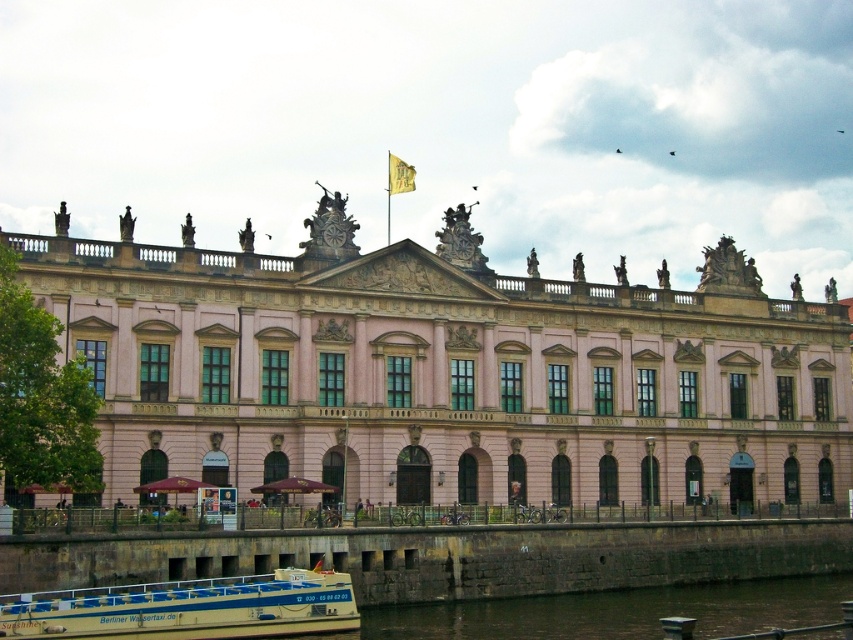
Question: Among these objects, which one is nearest to the camera?

Choices:
 (A) white plastic boat at lower left
 (B) pink stone building at center

Answer: (A)

Question: Which point is farther to the camera?

Choices:
 (A) (144, 624)
 (B) (405, 164)
 (C) (659, 634)
 (D) (775, 410)

Answer: (D)

Question: Which of these objects is positioned farthest from the dark stone wall at lower center?

Choices:
 (A) white plastic boat at lower left
 (B) yellow fabric flag at upper center

Answer: (B)

Question: Does pink stone building at center appear under yellow fabric flag at upper center?

Choices:
 (A) no
 (B) yes

Answer: (B)

Question: Observing the image, what is the correct spatial positioning of white plastic boat at lower left in reference to yellow fabric flag at upper center?

Choices:
 (A) above
 (B) below

Answer: (B)

Question: Is the position of dark stone wall at lower center less distant than that of yellow fabric flag at upper center?

Choices:
 (A) no
 (B) yes

Answer: (B)